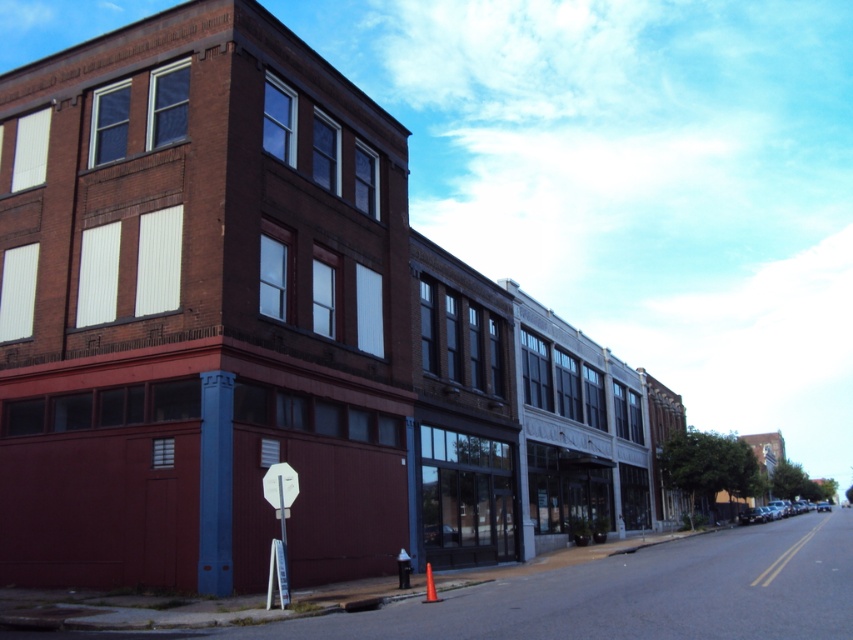
The height and width of the screenshot is (640, 853). Describe the element at coordinates (280, 522) in the screenshot. I see `white plastic stop sign at center` at that location.

Can you confirm if white plastic stop sign at center is wider than metallic pole at center?

Yes.

Is point (271, 490) more distant than point (281, 476)?

Yes, point (271, 490) is farther from viewer.

Identify the location of white plastic stop sign at center. [x=280, y=522].